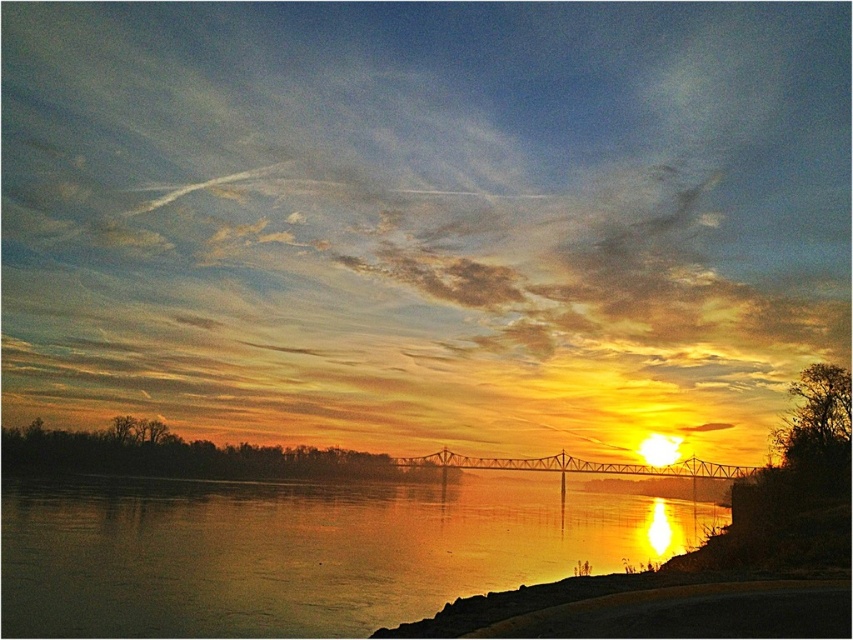
You are a photographer trying to capture the sunset reflection on the water. You have a camera with a wide lens that can capture large areas. Which object between the glossy water at center and the metallic bridge at center would be better to focus on to ensure both the reflection and the bridge are visible in the frame?

The glossy water at center is larger in size than the metallic bridge at center, so focusing on the glossy water at center would allow both the reflection and the bridge to fit within the frame more effectively.

You are standing on the shore of the river and want to know the distance between the glossy water at center and the metallic bridge at center. Can you tell me what it is?

The glossy water at center is 110.17 feet away from the metallic bridge at center.

You are an artist trying to paint this sunset scene. You want to ensure the proportions between the glossy water at center and the metallic bridge at center are accurate. Which object should you paint as taller?

The glossy water at center is taller than the metallic bridge at center, so you should paint the glossy water at center as taller.